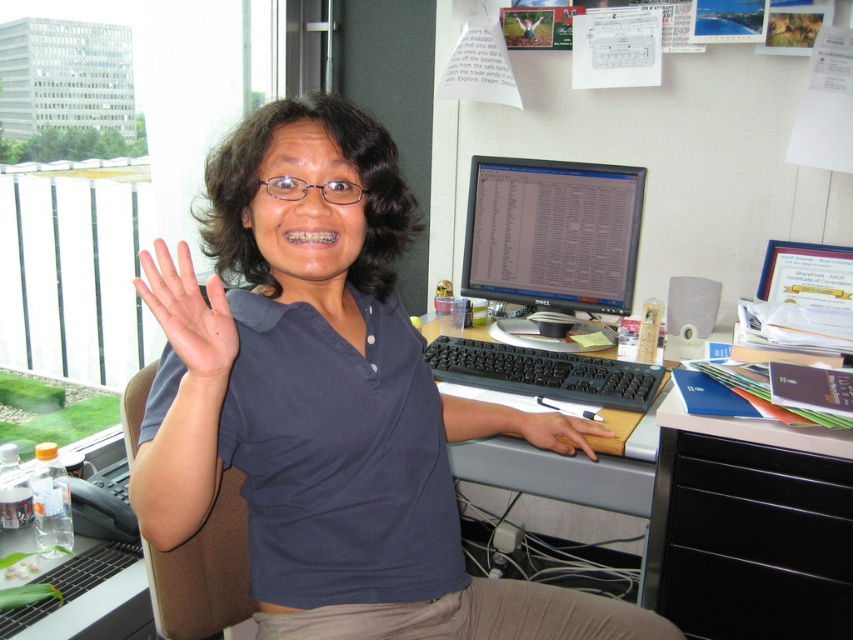
You are a delivery person entering an office and see the brown fabric swivel chair at left and the matte skin hand at center. Which object is closer to you as you approach the desk?

The brown fabric swivel chair at left is closer to you because the matte skin hand at center is behind it.

You are organizing items on the desk and need to place the clear plastic bottle at lower left and the brown leather hand at lower center. Based on their positions, which item is closer to the edge of the desk?

The clear plastic bottle at lower left is closer to the edge of the desk because it is positioned below the brown leather hand at lower center, which might be closer to the center or central part of the desk.